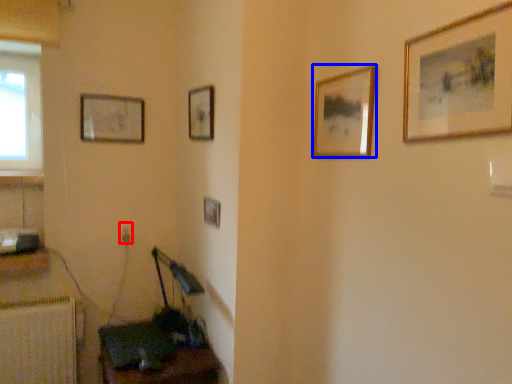
Question: Which of the following is the farthest to the observer, electric outlet (highlighted by a red box) or picture frame (highlighted by a blue box)?

Choices:
 (A) electric outlet
 (B) picture frame

Answer: (A)